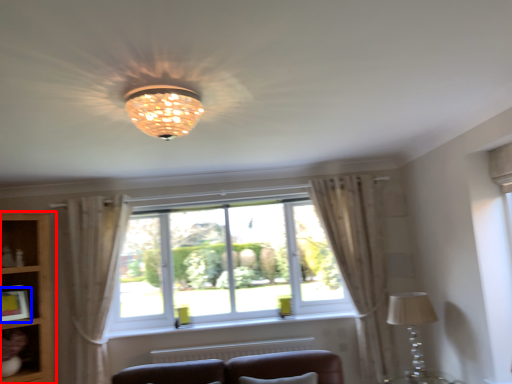
Question: Which object appears closest to the camera in this image, bookshelf (highlighted by a red box) or picture frame (highlighted by a blue box)?

Choices:
 (A) bookshelf
 (B) picture frame

Answer: (A)